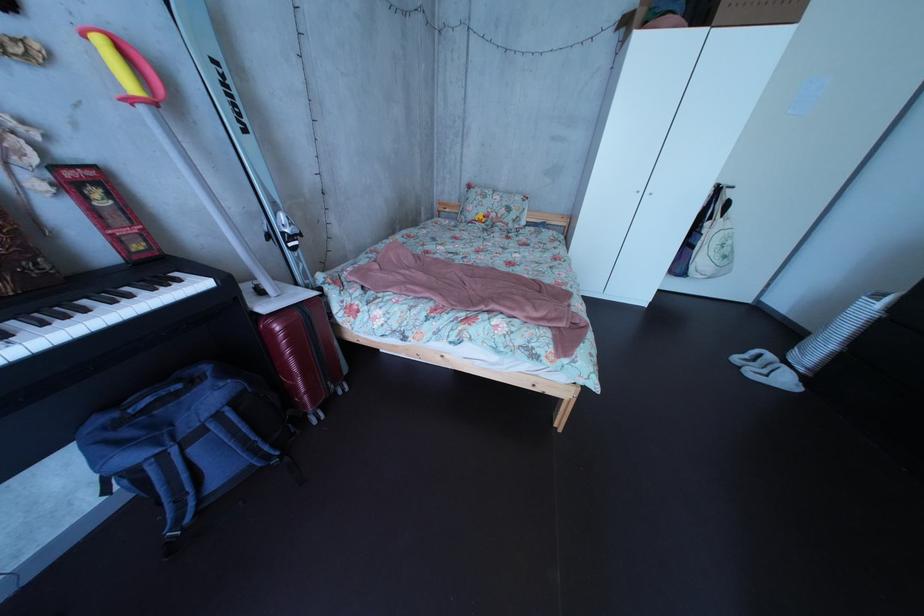
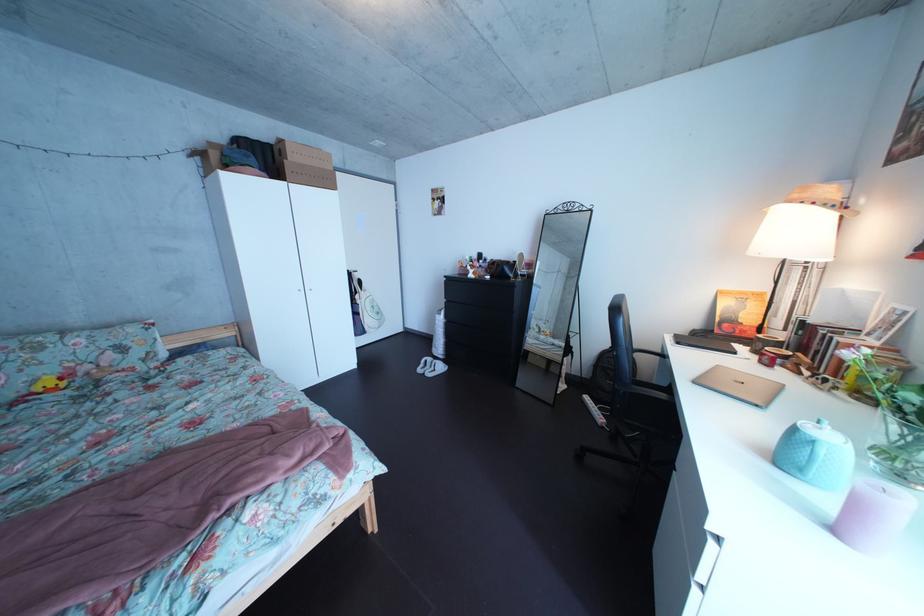
Question: How did the camera likely rotate?

Choices:
 (A) Left
 (B) Right
 (C) Up
 (D) Down

Answer: (B)